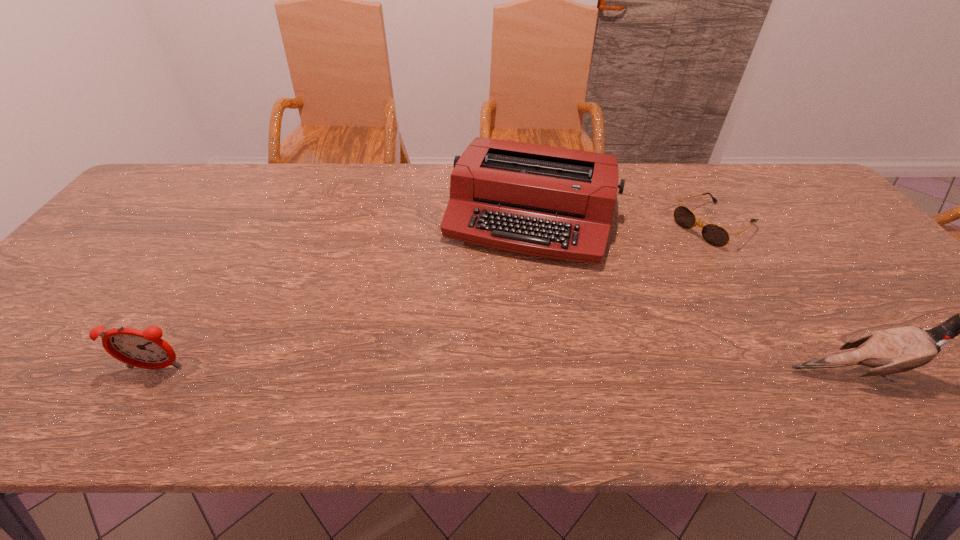
Image resolution: width=960 pixels, height=540 pixels. Identify the location of unoccupied area between the leftmost object and the tallest object. coord(505,370).

Locate an element on the screen. free space between the third object from right to left and the leftmost object is located at coordinates tap(343, 293).

Identify which object is the closest to the typewriter. Please provide its 2D coordinates. Your answer should be formatted as a tuple, i.e. [(x, y)], where the tuple contains the x and y coordinates of a point satisfying the conditions above.

[(715, 235)]

Select which object is the second closest to the typewriter. Please provide its 2D coordinates. Your answer should be formatted as a tuple, i.e. [(x, y)], where the tuple contains the x and y coordinates of a point satisfying the conditions above.

[(896, 350)]

Locate an element on the screen. vacant space that satisfies the following two spatial constraints: 1. on the front-facing side of the tallest object; 2. at the face of the leftmost object is located at coordinates (155, 372).

This screenshot has width=960, height=540. Identify the location of free space that satisfies the following two spatial constraints: 1. on the front side of the third object from right to left; 2. on the right side of the sunglasses. (531, 225).

You are a GUI agent. You are given a task and a screenshot of the screen. Output one action in this format:
    pyautogui.click(x=<x>, y=<y>)
    Task: Click on the vacant point that satisfies the following two spatial constraints: 1. on the front-facing side of the bird; 2. at the face of the leftmost object
    The width and height of the screenshot is (960, 540).
    Given the screenshot: What is the action you would take?
    pyautogui.click(x=155, y=372)